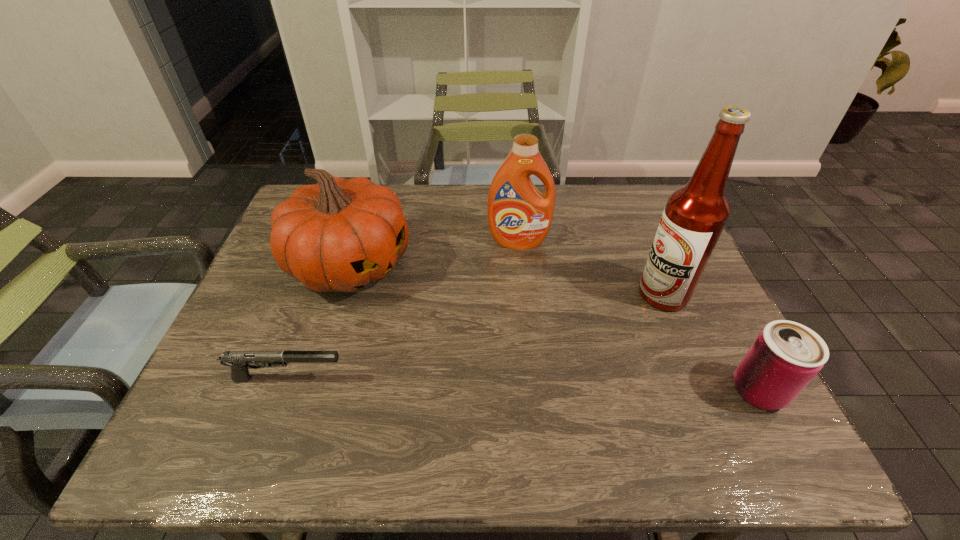
Where is `gun that is at the left edge`? gun that is at the left edge is located at coordinates (239, 361).

You are a GUI agent. You are given a task and a screenshot of the screen. Output one action in this format:
    pyautogui.click(x=<x>, y=<y>)
    Task: Click on the pumpkin that is at the left edge
    
    Given the screenshot: What is the action you would take?
    pyautogui.click(x=340, y=234)

This screenshot has height=540, width=960. Identify the location of can that is at the right edge. (785, 356).

Where is `alcohol that is at the right edge`? The width and height of the screenshot is (960, 540). alcohol that is at the right edge is located at coordinates (695, 215).

This screenshot has height=540, width=960. What are the coordinates of `object situated at the far left corner` in the screenshot? It's located at (340, 234).

The width and height of the screenshot is (960, 540). I want to click on object located in the near left corner section of the desktop, so click(x=239, y=361).

At what (x,y) coordinates should I click in order to perform the action: click on object that is positioned at the near right corner. Please return your answer as a coordinate pair (x, y). The image size is (960, 540). Looking at the image, I should click on (785, 356).

The width and height of the screenshot is (960, 540). I want to click on vacant region at the far edge of the desktop, so click(411, 193).

In the image, there is a desktop. Identify the location of vacant space at the near edge. (314, 406).

Image resolution: width=960 pixels, height=540 pixels. In the image, there is a desktop. Identify the location of vacant space at the left edge. (256, 318).